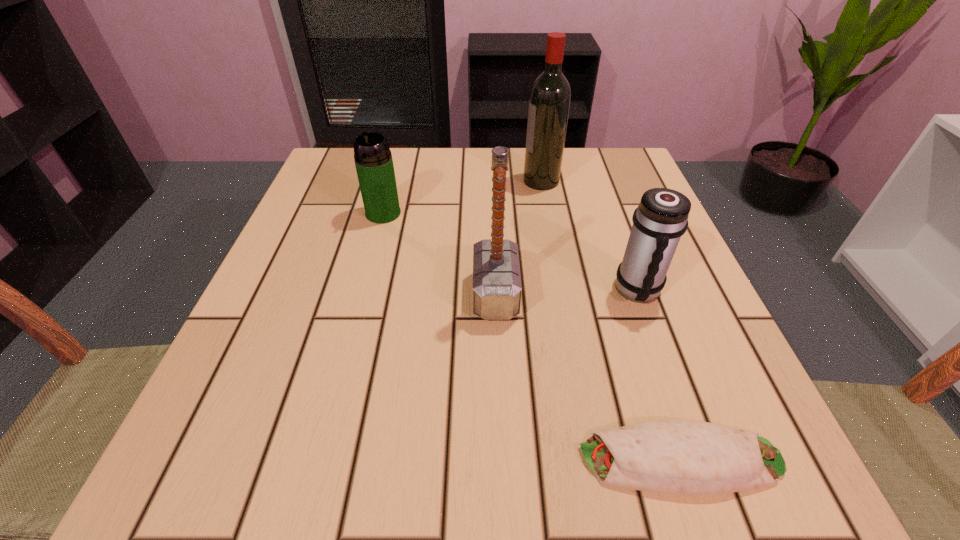
Find the location of a particular element. Image resolution: width=960 pixels, height=540 pixels. object that is at the near edge is located at coordinates (667, 456).

The height and width of the screenshot is (540, 960). Identify the location of object situated at the left edge. (373, 159).

You are a GUI agent. You are given a task and a screenshot of the screen. Output one action in this format:
    pyautogui.click(x=<x>, y=<y>)
    Task: Click on the thermos bottle present at the right edge
    Image resolution: width=960 pixels, height=540 pixels.
    Given the screenshot: What is the action you would take?
    pyautogui.click(x=661, y=218)

Locate an element on the screen. burrito at the right edge is located at coordinates (667, 456).

Where is `object at the far left corner`? object at the far left corner is located at coordinates (373, 159).

This screenshot has width=960, height=540. In order to click on object present at the near right corner in this screenshot , I will do `click(667, 456)`.

I want to click on free space at the far edge, so click(x=432, y=187).

Image resolution: width=960 pixels, height=540 pixels. I want to click on vacant space at the near edge, so click(x=405, y=448).

Where is `vacant area at the left edge`? vacant area at the left edge is located at coordinates (260, 401).

At what (x,y) coordinates should I click in order to perform the action: click on vacant space at the right edge. Please return your answer as a coordinate pair (x, y). This screenshot has height=540, width=960. Looking at the image, I should click on (610, 244).